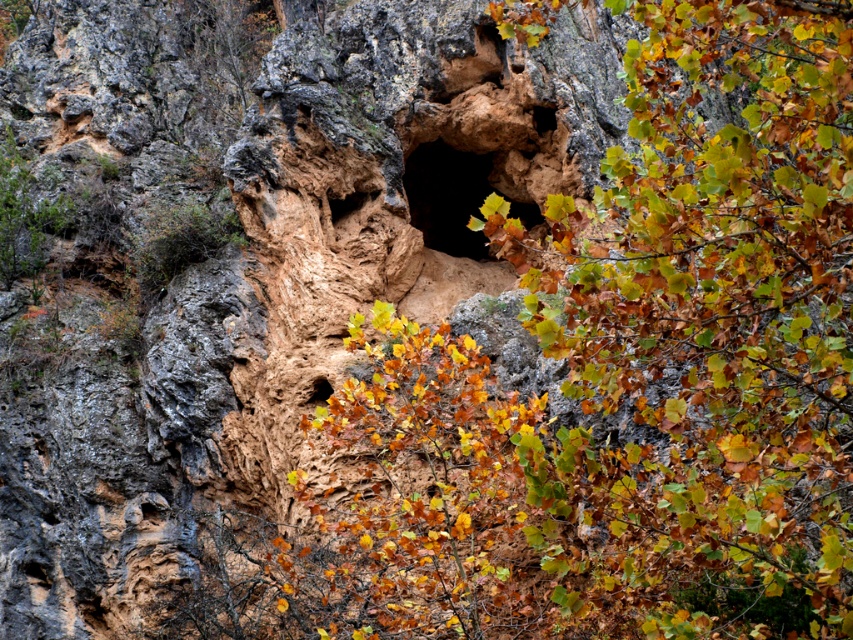
Can you confirm if dark rock hole at center is shorter than brown rough hole at center?

Yes, dark rock hole at center is shorter than brown rough hole at center.

How distant is dark rock hole at center from brown rough hole at center?

dark rock hole at center is 16.87 meters away from brown rough hole at center.

What do you see at coordinates (454, 196) in the screenshot? I see `dark rock hole at center` at bounding box center [454, 196].

You are a GUI agent. You are given a task and a screenshot of the screen. Output one action in this format:
    pyautogui.click(x=<x>, y=<y>)
    Task: Click on the dark rock hole at center
    Image resolution: width=853 pixels, height=640 pixels.
    Given the screenshot: What is the action you would take?
    pyautogui.click(x=454, y=196)